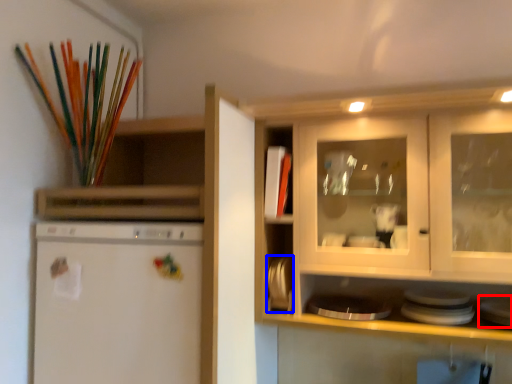
Question: Which object appears closest to the camera in this image, appliance (highlighted by a red box) or appliance (highlighted by a blue box)?

Choices:
 (A) appliance
 (B) appliance

Answer: (A)